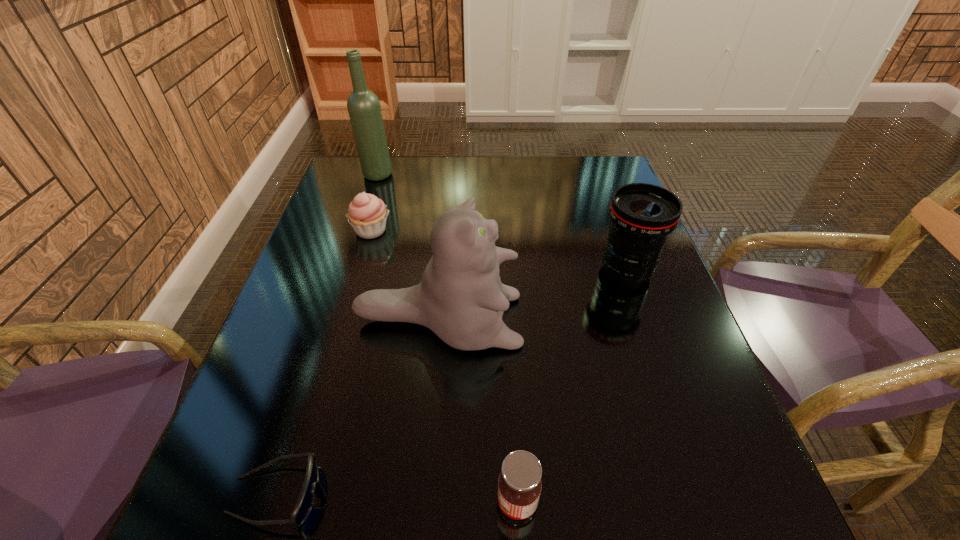
Image resolution: width=960 pixels, height=540 pixels. What are the coordinates of `the farthest object` in the screenshot? It's located at (364, 109).

Find the location of a particular element. This screenshot has width=960, height=540. wine bottle is located at coordinates (364, 109).

Locate an element on the screen. The width and height of the screenshot is (960, 540). the second tallest object is located at coordinates (461, 299).

Image resolution: width=960 pixels, height=540 pixels. I want to click on telephoto lens, so click(642, 215).

The width and height of the screenshot is (960, 540). I want to click on the rightmost object, so click(x=642, y=215).

Locate an element on the screen. the fifth nearest object is located at coordinates (367, 214).

At what (x,y) coordinates should I click in order to perform the action: click on jam. Please return your answer as a coordinate pair (x, y). Looking at the image, I should click on (519, 483).

Identify the location of the shortest object. This screenshot has height=540, width=960. (306, 498).

You are a GUI agent. You are given a task and a screenshot of the screen. Output one action in this format:
    pyautogui.click(x=<x>, y=<y>)
    Task: Click on the vacant space situated 0.190m on the right of the wine bottle
    
    Given the screenshot: What is the action you would take?
    pyautogui.click(x=455, y=174)

In order to click on free space located on the face of the fifth shortest object in this screenshot , I will do `click(592, 320)`.